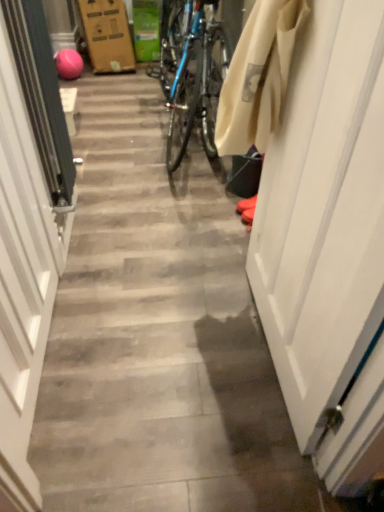
In order to face white matte door at right, which ranks as the 2th door in left-to-right order, should I rotate leftwards or rightwards?

To align with it, rotate right about 15.113°.

What do you see at coordinates (323, 213) in the screenshot? This screenshot has height=512, width=384. I see `white matte door at right, which ranks as the 2th door in left-to-right order` at bounding box center [323, 213].

Identify the location of white matte door at right, which ranks as the 2th door in left-to-right order. The image size is (384, 512). (323, 213).

Identify the location of white glossy door at left, the 1th door when ordered from left to right. (28, 231).

What do you see at coordinates (28, 231) in the screenshot?
I see `white glossy door at left, the 1th door when ordered from left to right` at bounding box center [28, 231].

This screenshot has height=512, width=384. Find the location of `white matte door at right, which ranks as the 2th door in left-to-right order`. white matte door at right, which ranks as the 2th door in left-to-right order is located at coordinates (x=323, y=213).

Considering the positions of objects white matte door at right, the 1th door from the right, and white glossy door at left, placed as the second door when sorted from right to left, in the image provided, who is more to the right, white matte door at right, the 1th door from the right, or white glossy door at left, placed as the second door when sorted from right to left,?

white matte door at right, the 1th door from the right, is more to the right.

Is white matte door at right, which ranks as the 2th door in left-to-right order, in front of or behind white glossy door at left, placed as the second door when sorted from right to left, in the image?

Visually, white matte door at right, which ranks as the 2th door in left-to-right order, is located in front of white glossy door at left, placed as the second door when sorted from right to left.

Which is in front, point (297, 306) or point (26, 356)?

The point (26, 356) is closer.

From the image's perspective, is white matte door at right, which ranks as the 2th door in left-to-right order, beneath white glossy door at left, placed as the second door when sorted from right to left?

No, from the image's perspective, white matte door at right, which ranks as the 2th door in left-to-right order, is not beneath white glossy door at left, placed as the second door when sorted from right to left.

From a real-world perspective, is white matte door at right, which ranks as the 2th door in left-to-right order, physically located above or below white glossy door at left, placed as the second door when sorted from right to left?

Clearly, from a real-world perspective, white matte door at right, which ranks as the 2th door in left-to-right order, is above white glossy door at left, placed as the second door when sorted from right to left.

Between white matte door at right, which ranks as the 2th door in left-to-right order, and white glossy door at left, the 1th door when ordered from left to right, which one has larger width?

With larger width is white glossy door at left, the 1th door when ordered from left to right.

In the scene shown: Considering the relative sizes of white matte door at right, the 1th door from the right, and white glossy door at left, the 1th door when ordered from left to right, in the image provided, is white matte door at right, the 1th door from the right, taller than white glossy door at left, the 1th door when ordered from left to right,?

Yes.

Looking at the image, does white matte door at right, which ranks as the 2th door in left-to-right order, seem bigger or smaller compared to white glossy door at left, the 1th door when ordered from left to right?

Clearly, white matte door at right, which ranks as the 2th door in left-to-right order, is smaller in size than white glossy door at left, the 1th door when ordered from left to right.

Is white matte door at right, which ranks as the 2th door in left-to-right order, not inside white glossy door at left, the 1th door when ordered from left to right?

That's correct, white matte door at right, which ranks as the 2th door in left-to-right order, is outside of white glossy door at left, the 1th door when ordered from left to right.

Based on the photo, is white matte door at right, which ranks as the 2th door in left-to-right order, far from white glossy door at left, placed as the second door when sorted from right to left?

That's not correct — white matte door at right, which ranks as the 2th door in left-to-right order, is a little close to white glossy door at left, placed as the second door when sorted from right to left.

Is white matte door at right, which ranks as the 2th door in left-to-right order, oriented towards white glossy door at left, the 1th door when ordered from left to right?

Yes, white matte door at right, which ranks as the 2th door in left-to-right order, is turned towards white glossy door at left, the 1th door when ordered from left to right.

The height and width of the screenshot is (512, 384). Identify the location of door on the right of white glossy door at left, the 1th door when ordered from left to right. (323, 213).

Considering the relative positions of white glossy door at left, the 1th door when ordered from left to right, and white matte door at right, which ranks as the 2th door in left-to-right order, in the image provided, is white glossy door at left, the 1th door when ordered from left to right, to the left or to the right of white matte door at right, which ranks as the 2th door in left-to-right order,?

white glossy door at left, the 1th door when ordered from left to right, is positioned on white matte door at right, which ranks as the 2th door in left-to-right order,'s left side.

Between white glossy door at left, placed as the second door when sorted from right to left, and white matte door at right, which ranks as the 2th door in left-to-right order, which one is positioned in front?

white matte door at right, which ranks as the 2th door in left-to-right order, is more forward.

Is point (4, 57) farther from viewer compared to point (264, 229)?

No, it is not.

In the scene shown: From the image's perspective, between white glossy door at left, placed as the second door when sorted from right to left, and white matte door at right, which ranks as the 2th door in left-to-right order, which one is located above?

white matte door at right, which ranks as the 2th door in left-to-right order, appears higher in the image.

From a real-world perspective, which object rests below the other?

From a 3D spatial view, white glossy door at left, placed as the second door when sorted from right to left, is below.

Considering the sizes of white glossy door at left, placed as the second door when sorted from right to left, and white matte door at right, which ranks as the 2th door in left-to-right order, in the image, is white glossy door at left, placed as the second door when sorted from right to left, wider or thinner than white matte door at right, which ranks as the 2th door in left-to-right order,?

Considering their sizes, white glossy door at left, placed as the second door when sorted from right to left, looks broader than white matte door at right, which ranks as the 2th door in left-to-right order.

Considering the relative sizes of white glossy door at left, the 1th door when ordered from left to right, and white matte door at right, which ranks as the 2th door in left-to-right order, in the image provided, is white glossy door at left, the 1th door when ordered from left to right, taller than white matte door at right, which ranks as the 2th door in left-to-right order,?

Incorrect, the height of white glossy door at left, the 1th door when ordered from left to right, is not larger of that of white matte door at right, which ranks as the 2th door in left-to-right order.

Which of these two, white glossy door at left, placed as the second door when sorted from right to left, or white matte door at right, the 1th door from the right, is smaller?

With smaller size is white matte door at right, the 1th door from the right.

Is white glossy door at left, placed as the second door when sorted from right to left, spatially inside white matte door at right, which ranks as the 2th door in left-to-right order, or outside of it?

white glossy door at left, placed as the second door when sorted from right to left, lies outside white matte door at right, which ranks as the 2th door in left-to-right order.

Is the surface of white glossy door at left, placed as the second door when sorted from right to left, in direct contact with white matte door at right, which ranks as the 2th door in left-to-right order?

No, white glossy door at left, placed as the second door when sorted from right to left, is not in contact with white matte door at right, which ranks as the 2th door in left-to-right order.

Is white glossy door at left, placed as the second door when sorted from right to left, facing away from white matte door at right, the 1th door from the right?

Yes, white glossy door at left, placed as the second door when sorted from right to left, is facing away from white matte door at right, the 1th door from the right.

How different are the orientations of white glossy door at left, placed as the second door when sorted from right to left, and white matte door at right, the 1th door from the right, in degrees?

The facing directions of white glossy door at left, placed as the second door when sorted from right to left, and white matte door at right, the 1th door from the right, are 179 degrees apart.

At what (x,y) coordinates should I click in order to perform the action: click on door below the white matte door at right, which ranks as the 2th door in left-to-right order (from the image's perspective). Please return your answer as a coordinate pair (x, y). The height and width of the screenshot is (512, 384). Looking at the image, I should click on (28, 231).

Find the location of a particular element. door above the white glossy door at left, the 1th door when ordered from left to right (from a real-world perspective) is located at coordinates (323, 213).

In the image, there is a white matte door at right, the 1th door from the right. Where is `door below it (from the image's perspective)`? door below it (from the image's perspective) is located at coordinates (28, 231).